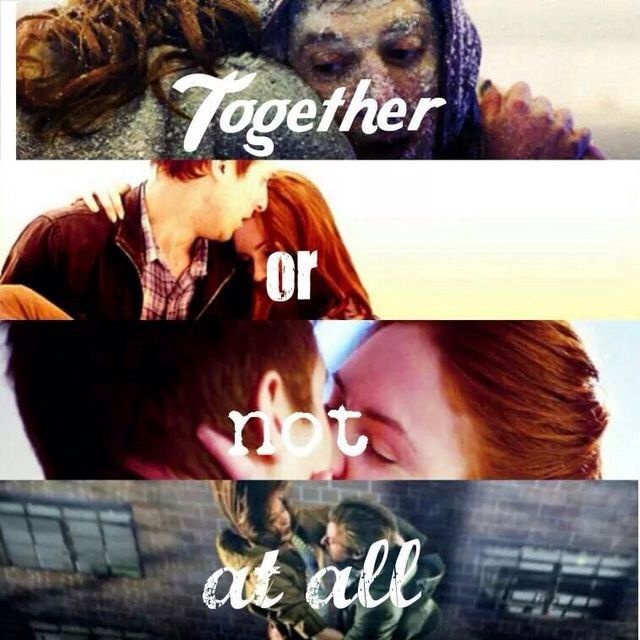
What are the coordinates of `hoods` in the screenshot? It's located at (429, 582), (225, 548).